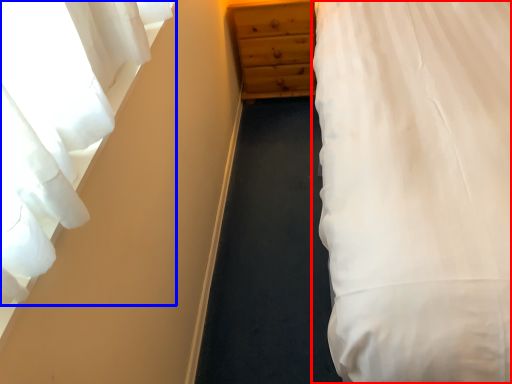
Question: Which point is closer to the camera, bed (highlighted by a red box) or curtain (highlighted by a blue box)?

Choices:
 (A) bed
 (B) curtain

Answer: (A)